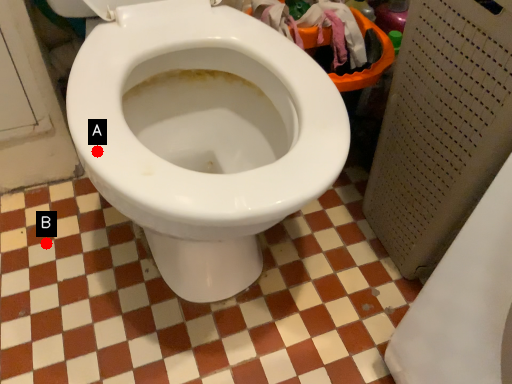
Question: Two points are circled on the image, labeled by A and B beside each circle. Which point is closer to the camera?

Choices:
 (A) A is closer
 (B) B is closer

Answer: (A)